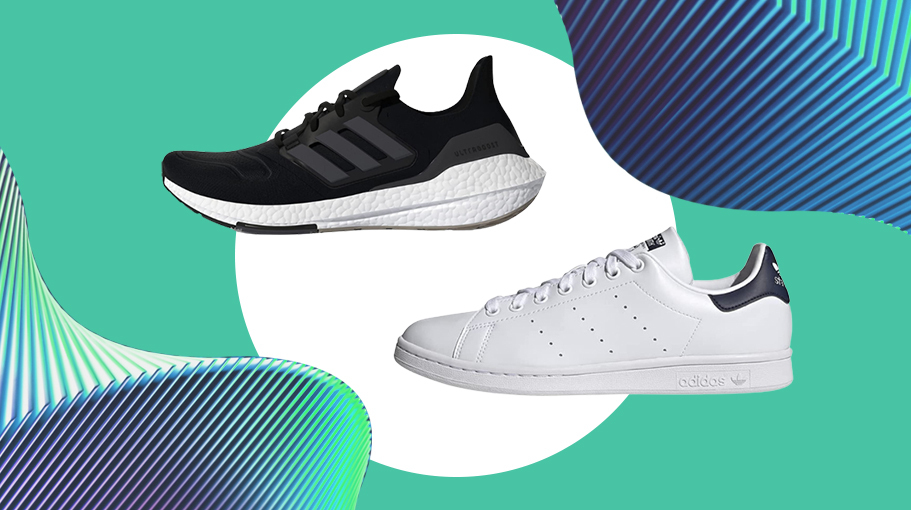
Where is `corners`? This screenshot has height=510, width=911. corners is located at coordinates (810, 22), (824, 31), (843, 45), (857, 53).